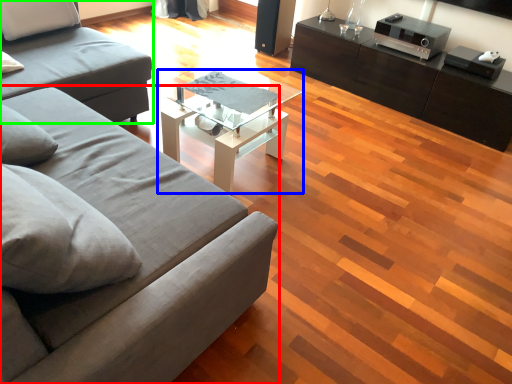
Question: Considering the real-world distances, which object is closest to studio couch (highlighted by a red box)? coffee table (highlighted by a blue box) or studio couch (highlighted by a green box).

Choices:
 (A) coffee table
 (B) studio couch

Answer: (A)